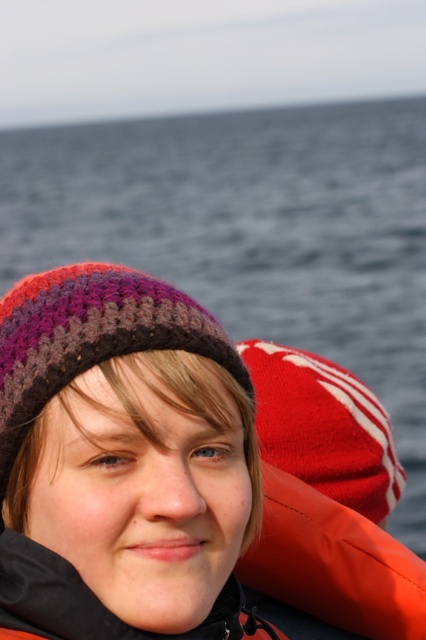
Consider the image. Is knitted woolen hat at center to the right of orange synthetic life jacket at right from the viewer's perspective?

No, knitted woolen hat at center is not to the right of orange synthetic life jacket at right.

Identify the location of knitted woolen hat at center. (161, 481).

Does knitted woolen hat at left appear over orange synthetic life jacket at right?

Yes, knitted woolen hat at left is above orange synthetic life jacket at right.

Is knitted woolen hat at left thinner than orange synthetic life jacket at right?

Correct, knitted woolen hat at left's width is less than orange synthetic life jacket at right's.

Find the location of `knitted woolen hat at left`. knitted woolen hat at left is located at coordinates (89, 337).

Where is `knitted woolen hat at left`? The width and height of the screenshot is (426, 640). knitted woolen hat at left is located at coordinates (89, 337).

Which is behind, point (210, 424) or point (55, 296)?

Positioned behind is point (55, 296).

Looking at this image, is knitted woolen hat at center above knitted woolen hat at left?

No.

Is point (226, 394) positioned before point (46, 378)?

No, (226, 394) is behind (46, 378).

Where is `knitted woolen hat at center`? knitted woolen hat at center is located at coordinates (161, 481).